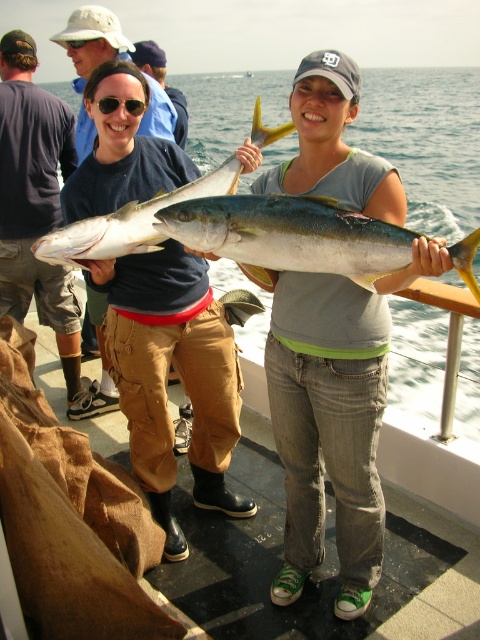
Does matte blue shirt at center appear on the left side of shiny silver fish at center?

Correct, you'll find matte blue shirt at center to the left of shiny silver fish at center.

What do you see at coordinates (36, 205) in the screenshot? This screenshot has height=640, width=480. I see `matte blue shirt at center` at bounding box center [36, 205].

The width and height of the screenshot is (480, 640). In order to click on matte blue shirt at center in this screenshot , I will do `click(36, 205)`.

Who is more forward, [167,308] or [78,241]?

Point [78,241] is more forward.

Is matte black shirt at center thinner than shiny silver fish at center?

Yes, matte black shirt at center is thinner than shiny silver fish at center.

The image size is (480, 640). What are the coordinates of `matte black shirt at center` in the screenshot? It's located at (167, 376).

Find the location of a particular element. Image resolution: width=480 pixels, height=640 pixels. matte black shirt at center is located at coordinates (167, 376).

Is point (66, 348) positioned behind point (97, 22)?

Yes, it is behind point (97, 22).

Is matte blue shirt at center bigger than matte black shirt at left?

No.

Find the location of `matte blue shirt at center`. matte blue shirt at center is located at coordinates pos(36,205).

The width and height of the screenshot is (480, 640). In order to click on matte blue shirt at center in this screenshot , I will do `click(36, 205)`.